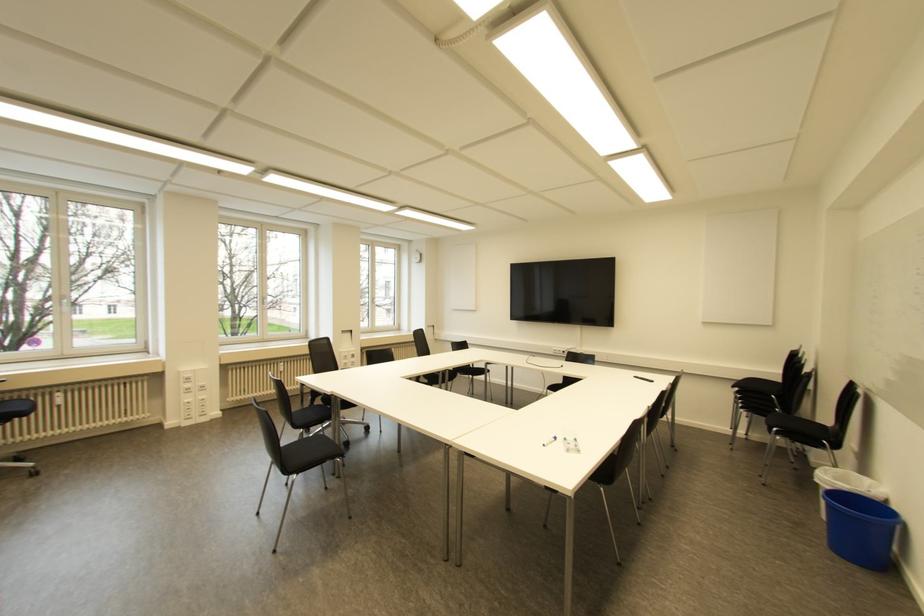
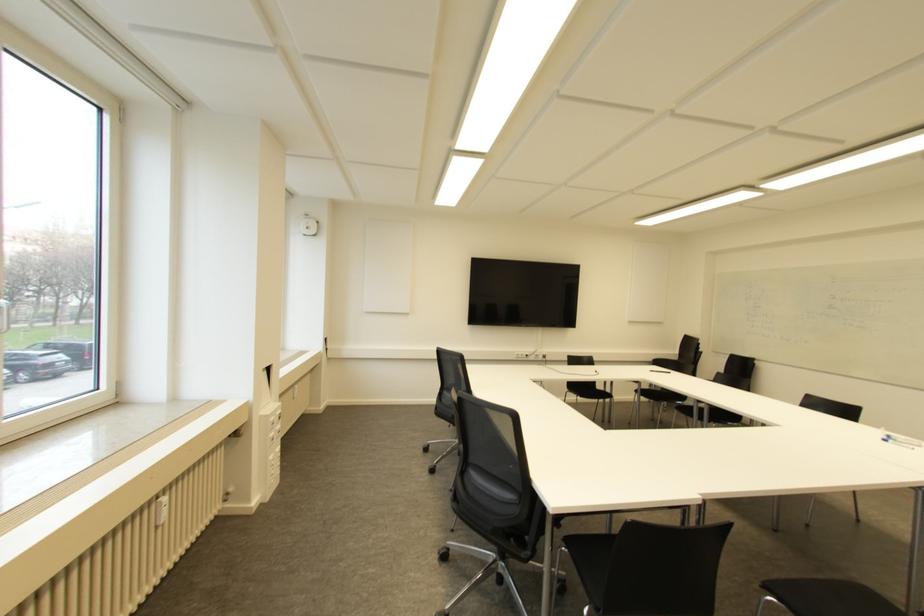
Question: I am providing you with two images of the same scene from different viewpoints. After the viewpoint changes to image2, which objects are now occluded?

Choices:
 (A) blue plastic bin
 (B) blue whiteboard marker
 (C) white power outlet
 (D) door lock

Answer: (A)